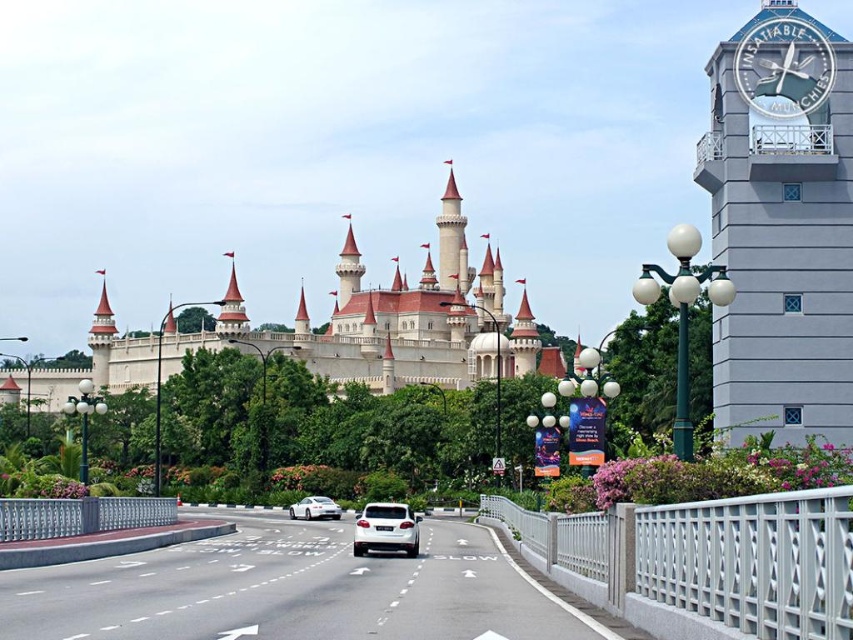
Does white asphalt highway at center appear under white glossy car at center?

Incorrect, white asphalt highway at center is not positioned below white glossy car at center.

I want to click on white asphalt highway at center, so click(293, 589).

Locate an element on the screen. white asphalt highway at center is located at coordinates tap(293, 589).

Is white asphalt highway at center further to the viewer compared to white metallic clock at upper right?

That is False.

Can you confirm if white asphalt highway at center is shorter than white metallic clock at upper right?

In fact, white asphalt highway at center may be taller than white metallic clock at upper right.

At what (x,y) coordinates should I click in order to perform the action: click on white asphalt highway at center. Please return your answer as a coordinate pair (x, y). The width and height of the screenshot is (853, 640). Looking at the image, I should click on (293, 589).

Locate an element on the screen. The width and height of the screenshot is (853, 640). white asphalt highway at center is located at coordinates (293, 589).

Can you confirm if gray concrete clock tower at upper right is positioned below white glossy car at center?

Incorrect, gray concrete clock tower at upper right is not positioned below white glossy car at center.

Does gray concrete clock tower at upper right have a greater height compared to white glossy car at center?

Correct, gray concrete clock tower at upper right is much taller as white glossy car at center.

Image resolution: width=853 pixels, height=640 pixels. What do you see at coordinates (781, 225) in the screenshot? I see `gray concrete clock tower at upper right` at bounding box center [781, 225].

Image resolution: width=853 pixels, height=640 pixels. Find the location of `gray concrete clock tower at upper right`. gray concrete clock tower at upper right is located at coordinates (781, 225).